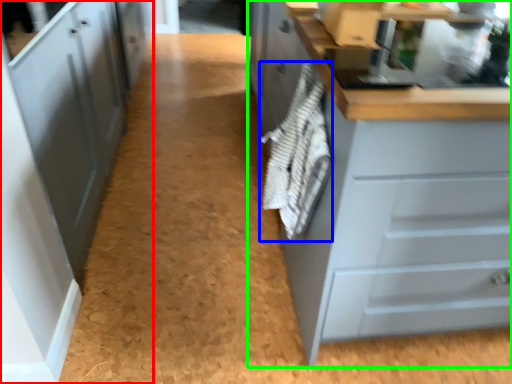
Question: Which object is the farthest from cabinetry (highlighted by a red box)? Choose among these: material (highlighted by a blue box) or cabinetry (highlighted by a green box).

Choices:
 (A) material
 (B) cabinetry

Answer: (B)